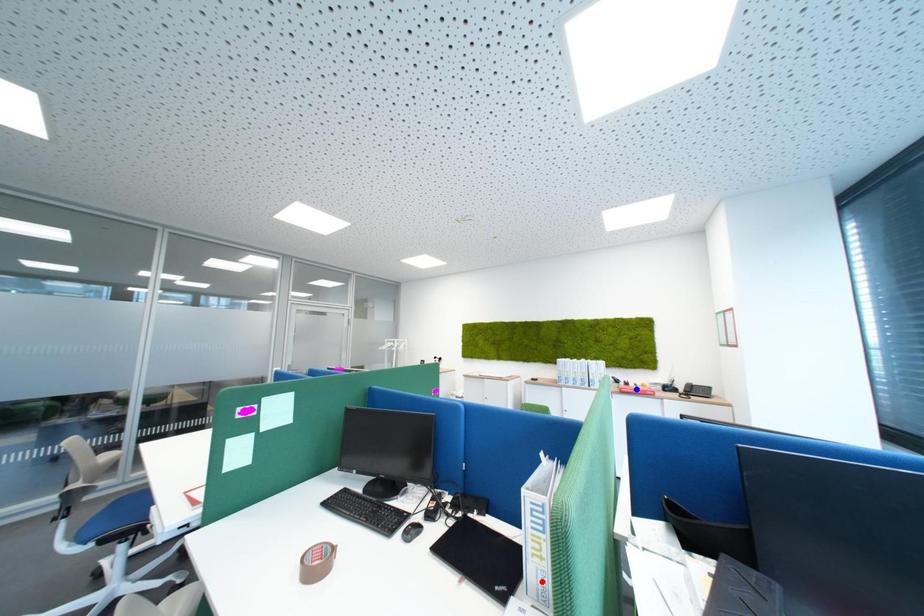
Question: Two points are marked on the image. Which point is closer to the camera?

Choices:
 (A) Blue point is closer.
 (B) Red point is closer.

Answer: (B)